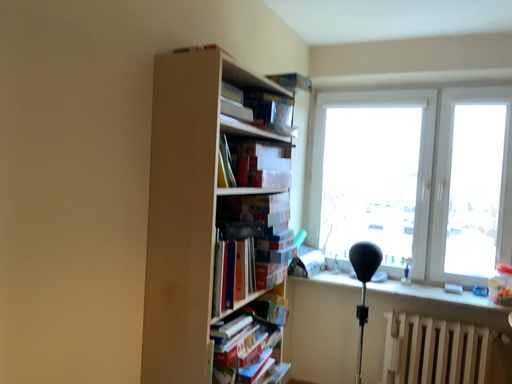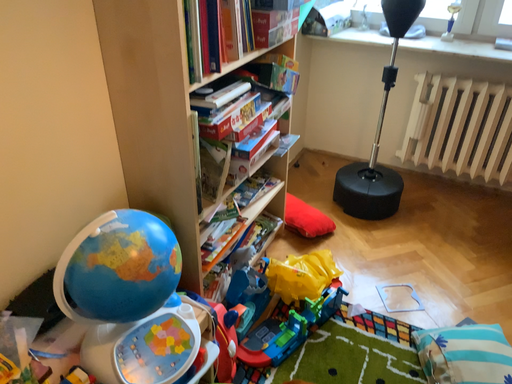
Question: Which way did the camera rotate in the video?

Choices:
 (A) rotated upward
 (B) rotated downward

Answer: (B)